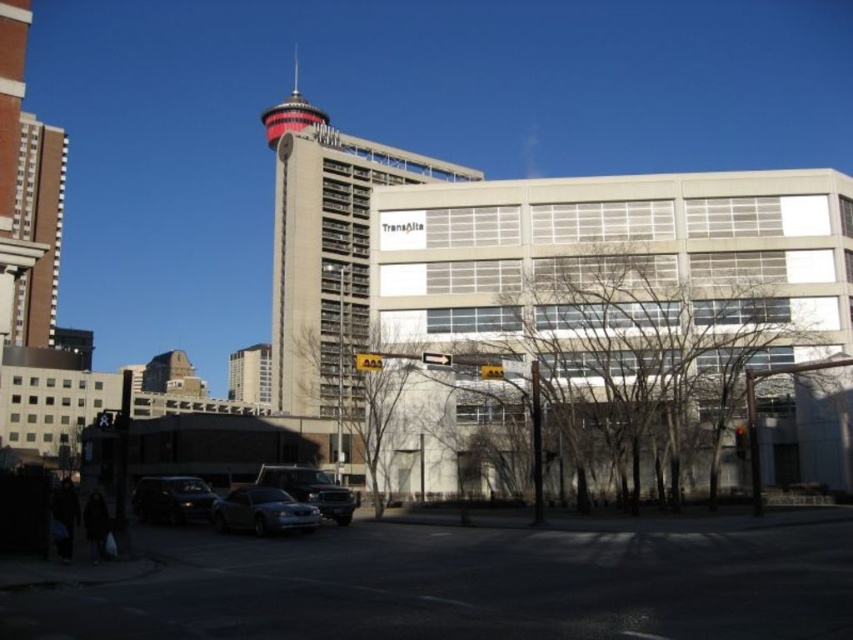
Is point (169, 492) positioned before point (300, 500)?

No, it is not.

Which is above, shiny black suv at lower left or shiny silver sedan at center?

shiny silver sedan at center is above.

Who is more forward, (143, 481) or (291, 476)?

Positioned in front is point (291, 476).

At what (x,y) coordinates should I click in order to perform the action: click on shiny black suv at lower left. Please return your answer as a coordinate pair (x, y). The height and width of the screenshot is (640, 853). Looking at the image, I should click on (171, 499).

Is shiny silver sedan at center bigger than red and white striped tower at upper center?

No.

Which is above, shiny silver sedan at center or red and white striped tower at upper center?

Positioned higher is red and white striped tower at upper center.

Find the location of a particular element. This screenshot has width=853, height=640. shiny silver sedan at center is located at coordinates (310, 490).

Is point (51, 264) positioned behind point (280, 104)?

That is False.

Is brown concrete building at left positioned behind red and white striped tower at upper center?

No, it is not.

The height and width of the screenshot is (640, 853). What are the coordinates of `brown concrete building at left` in the screenshot? It's located at (38, 227).

The width and height of the screenshot is (853, 640). What are the coordinates of `brown concrete building at left` in the screenshot? It's located at pos(38,227).